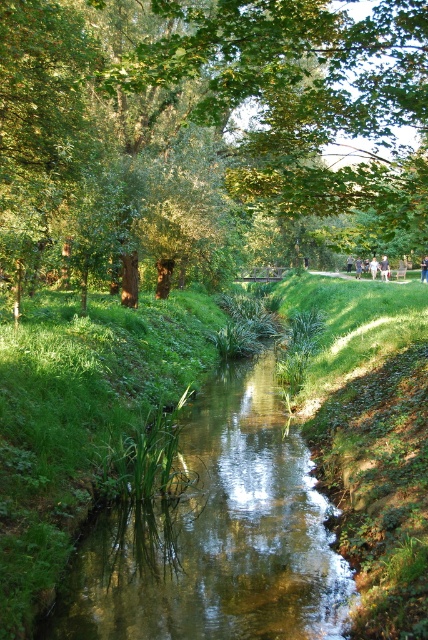
You are a hiker who has just arrived at the stream. You see the clear water stream at center and the blue denim jeans at center. Which object is positioned to the left of the other?

The clear water stream at center is to the left of the blue denim jeans at center.

You are standing at the edge of the clear water stream at center and notice the blue denim jeans at center in the water. Can you tell me which one is taller between the two?

The clear water stream at center is not as tall as blue denim jeans at center, so the blue denim jeans at center is taller.

You are standing at the edge of the stream and see the green leafy tree at upper center and the light blue denim shorts at center. Which object is positioned to the left when facing the scene?

The green leafy tree at upper center is positioned to the left of the light blue denim shorts at center.